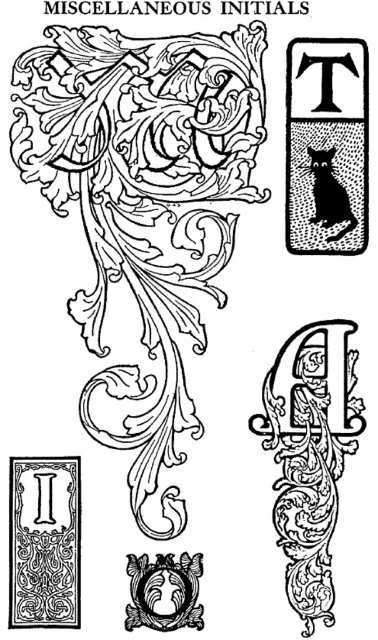
You are an artist trying to replicate the intricate details of the letter T in the image. You notice two specific points on the T. One is at coordinates point [328,620] and the other at point [144,579]. Which of these points is closer to you as you view the letter T from the front?

Point [328,620] is closer to the camera than point [144,579].

Consider the image. You are an art student analyzing the image of decorative letter initials. You notice the black dotted cat at upper right. Can you determine its exact coordinates within the image?

The black dotted cat at upper right is located at coordinates point (326,145).